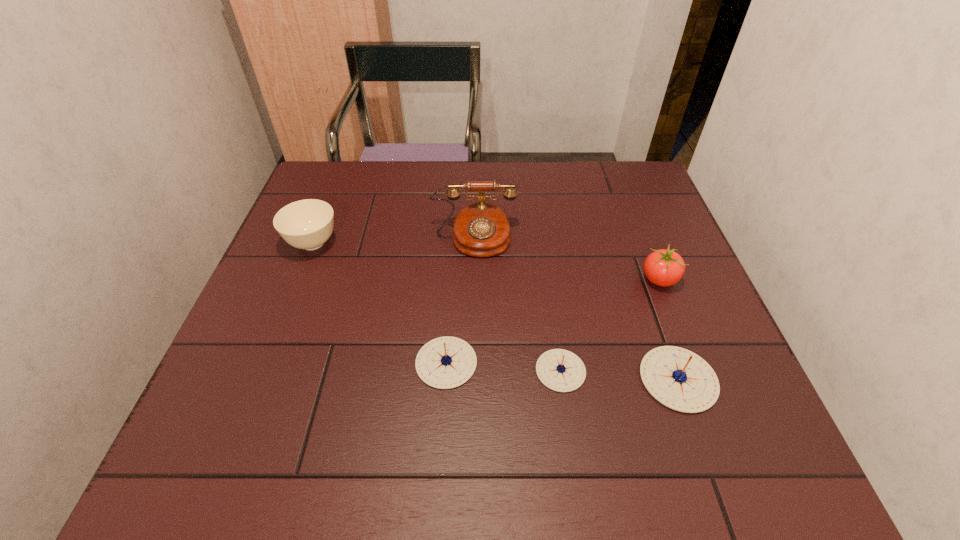
The height and width of the screenshot is (540, 960). Identify the location of vacant space situated on the back of the tallest compass. (653, 308).

Find the location of a particular element. vacant point located 0.060m on the dial of the tallest object is located at coordinates (473, 276).

This screenshot has height=540, width=960. I want to click on free spot located 0.370m on the back of the third farthest object, so click(x=621, y=182).

Locate an element on the screen. free space located 0.240m on the front of the sugar bowl is located at coordinates (275, 341).

Identify the location of object at the left edge. The width and height of the screenshot is (960, 540). (307, 224).

At what (x,y) coordinates should I click in order to perform the action: click on compass that is positioned at the right edge. Please return your answer as a coordinate pair (x, y). The image size is (960, 540). Looking at the image, I should click on (681, 380).

Locate an element on the screen. The width and height of the screenshot is (960, 540). tomato positioned at the right edge is located at coordinates (663, 267).

You are a GUI agent. You are given a task and a screenshot of the screen. Output one action in this format:
    pyautogui.click(x=<x>, y=<y>)
    Task: Click on the object present at the near right corner
    
    Given the screenshot: What is the action you would take?
    pyautogui.click(x=681, y=380)

At what (x,y) coordinates should I click in order to perform the action: click on free space at the far edge of the desktop. Please return your answer as a coordinate pair (x, y). Looking at the image, I should click on (525, 161).

In the image, there is a desktop. Where is `vacant space at the near edge`? This screenshot has height=540, width=960. vacant space at the near edge is located at coordinates coord(310,378).